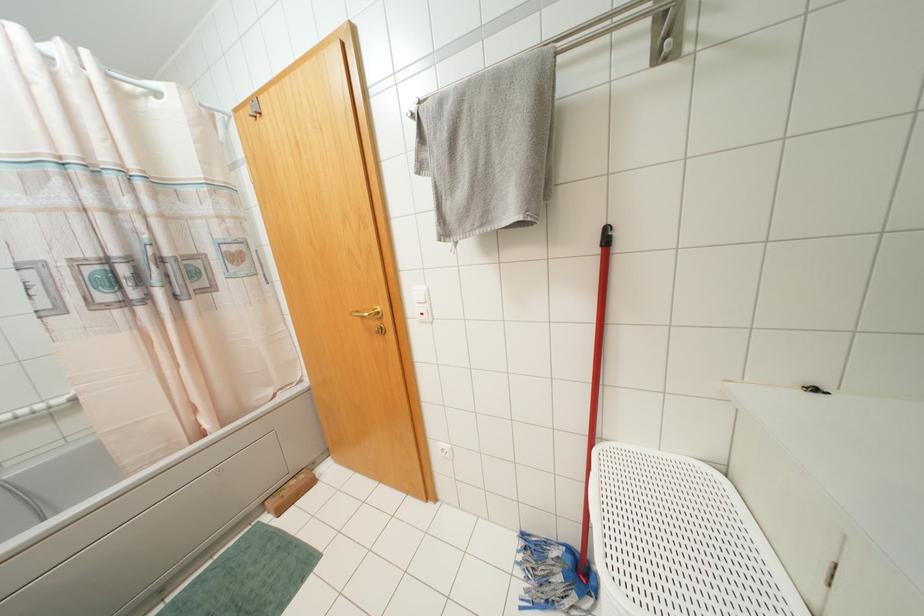
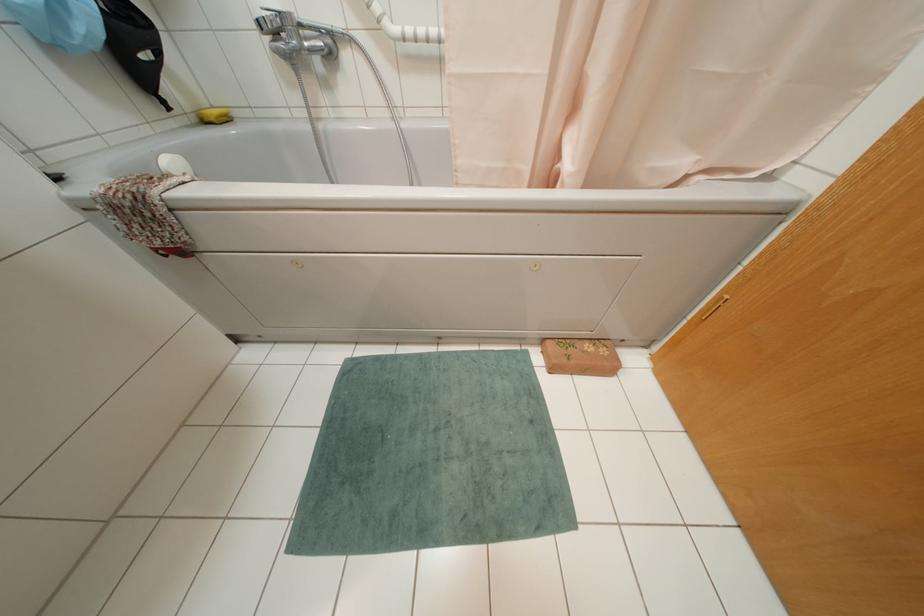
In the second image, find the point that corresponds to pixel 300 476 in the first image.

(602, 351)